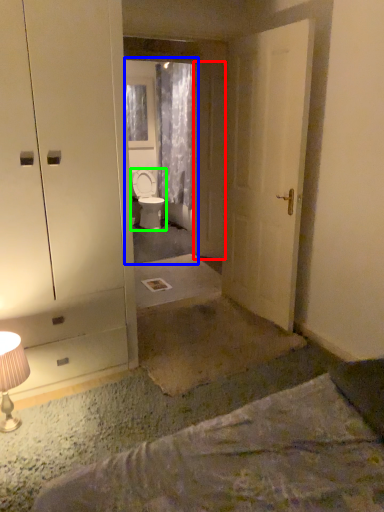
Question: Which object is positioned farthest from door (highlighted by a red box)? Select from mirror (highlighted by a blue box) and toilet (highlighted by a green box).

Choices:
 (A) mirror
 (B) toilet

Answer: (B)